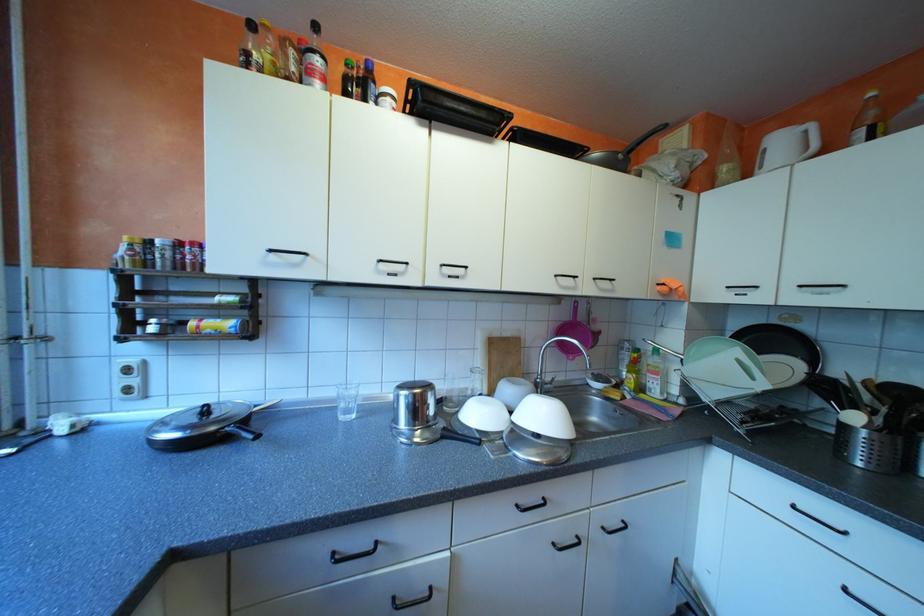
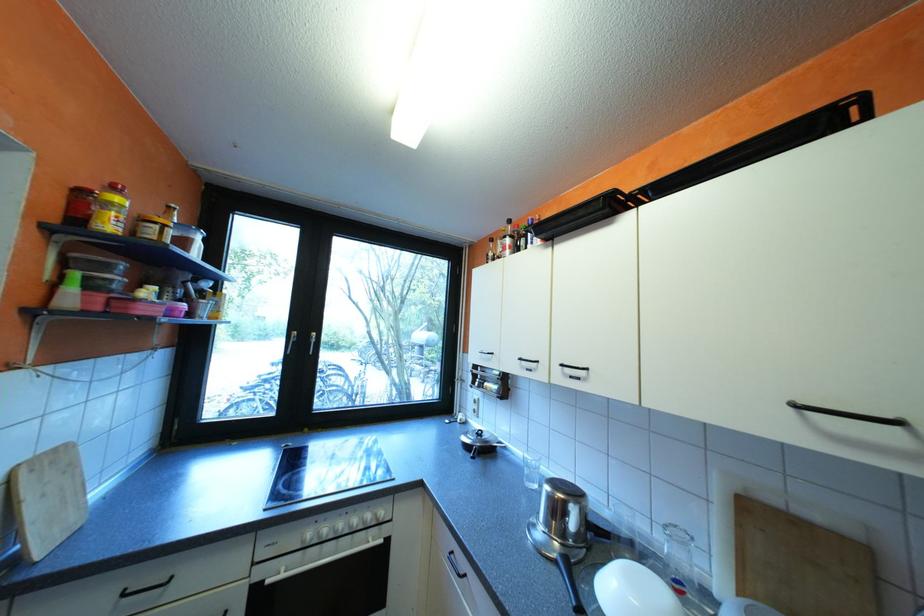
Question: Based on the continuous images, in which direction is the camera rotating? Reply with the corresponding letter.

Choices:
 (A) Left
 (B) Right
 (C) Up
 (D) Down

Answer: (A)